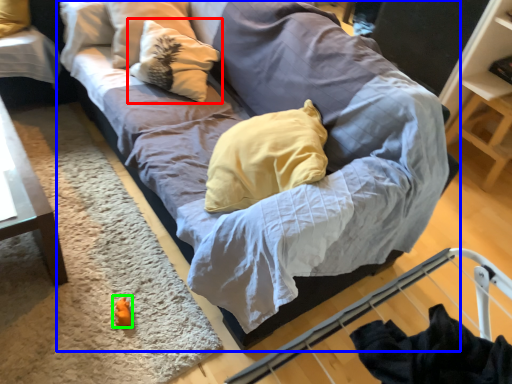
Question: Considering the real-world distances, which object is farthest from pillow (highlighted by a red box)? studio couch (highlighted by a blue box) or toy (highlighted by a green box)?

Choices:
 (A) studio couch
 (B) toy

Answer: (B)